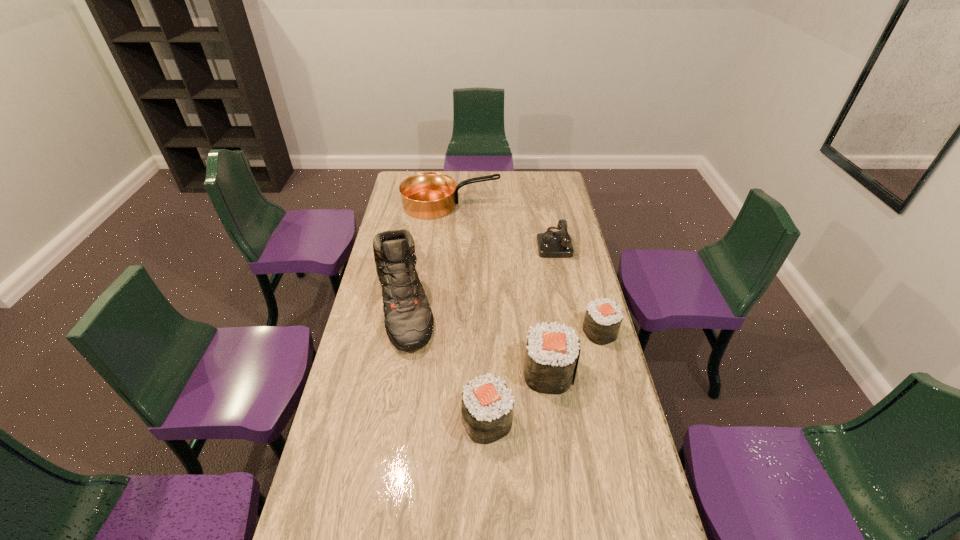
The image size is (960, 540). In order to click on free spot between the tallest object and the rightmost sushi in this screenshot , I will do `click(502, 319)`.

The image size is (960, 540). Identify the location of free area in between the telephone and the shortest sushi. (577, 287).

Where is `free space between the second farthest sushi and the farthest object`? free space between the second farthest sushi and the farthest object is located at coordinates (499, 288).

What are the coordinates of `free space between the second nearest sushi and the tallest object` in the screenshot? It's located at (476, 340).

Where is `free spot between the farthest sushi and the frying pan`? Image resolution: width=960 pixels, height=540 pixels. free spot between the farthest sushi and the frying pan is located at coordinates (525, 268).

Identify the location of object that stands as the second closest to the rightmost sushi. This screenshot has height=540, width=960. (552, 244).

Identify which object is the fifth nearest to the second farthest object. Please provide its 2D coordinates. Your answer should be formatted as a tuple, i.e. [(x, y)], where the tuple contains the x and y coordinates of a point satisfying the conditions above.

[(487, 406)]

Locate which sushi ranks second in proximity to the fifth nearest object. Please provide its 2D coordinates. Your answer should be formatted as a tuple, i.e. [(x, y)], where the tuple contains the x and y coordinates of a point satisfying the conditions above.

[(552, 354)]

Select which sushi is the second closest to the nearest sushi. Please provide its 2D coordinates. Your answer should be formatted as a tuple, i.e. [(x, y)], where the tuple contains the x and y coordinates of a point satisfying the conditions above.

[(603, 318)]

The width and height of the screenshot is (960, 540). Identify the location of free location that satisfies the following two spatial constraints: 1. on the handle side of the farthest object; 2. on the back side of the nearest object. (431, 421).